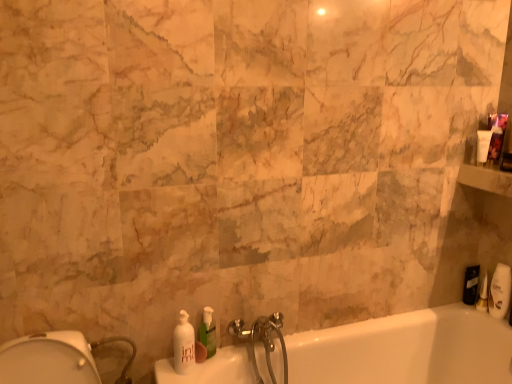
Question: Is point tap(175, 344) closer or farther from the camera than point tap(312, 350)?

Choices:
 (A) farther
 (B) closer

Answer: (B)

Question: Is white glossy soap dispenser at lower left, positioned as the 1th soap dispenser in left-to-right order, to the left or to the right of white glossy bathtub at lower right in the image?

Choices:
 (A) left
 (B) right

Answer: (A)

Question: Which of these objects is positioned closest to the white glossy soap dispenser at lower left, the second soap dispenser positioned from the right?

Choices:
 (A) white plastic soap dispenser at right, which is the second toiletry in back-to-front order
 (B) silver metallic faucet at lower center
 (C) white glossy bathtub at lower right
 (D) black matte toiletry at right, which is counted as the 1th toiletry, starting from the back
 (E) green translucent soap dispenser at lower center, the 2th soap dispenser when ordered from left to right

Answer: (E)

Question: Which of these objects is positioned farthest from the white plastic soap dispenser at right, which is the second toiletry in back-to-front order?

Choices:
 (A) white glossy soap dispenser at lower left, positioned as the 1th soap dispenser in left-to-right order
 (B) white glossy bathtub at lower right
 (C) black matte toiletry at right, which appears as the 2th toiletry when viewed from the front
 (D) silver metallic faucet at lower center
 (E) green translucent soap dispenser at lower center, which ranks as the first soap dispenser in right-to-left order

Answer: (A)